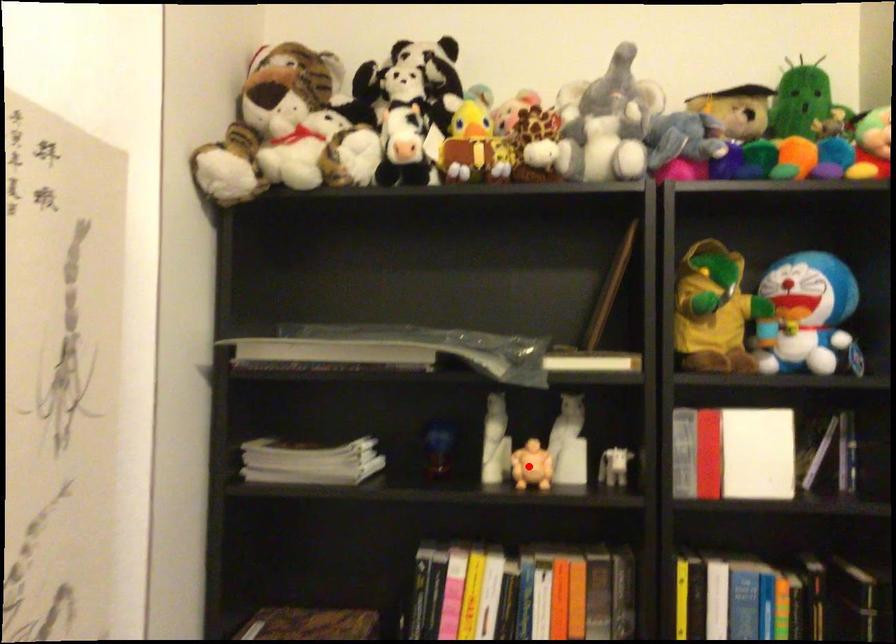
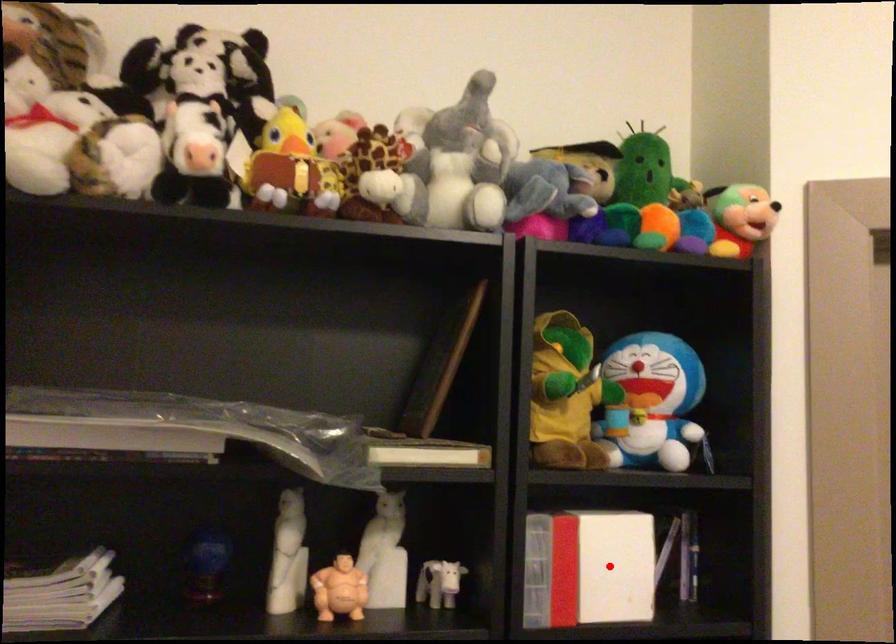
I am providing you with two images of the same scene from different viewpoints. A red point is marked on the first image and another point is marked on the second image. Does the point marked in image1 correspond to the same location as the one in image2?

No